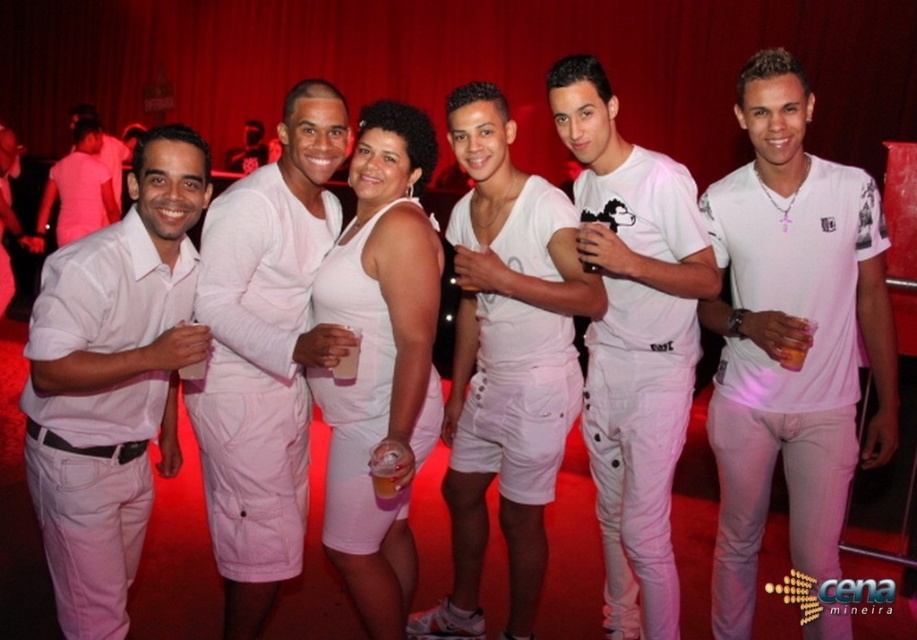
You are a photographer at the event and want to ensure that both the white fabric tank top at center and the white matte pants at center are clearly visible in the photo. Given their widths, which clothing item might require more careful framing to avoid being too wide for the camera lens? Explain your reasoning based on their sizes.

The white fabric tank top at center has a greater width than the white matte pants at center. Therefore, the white fabric tank top at center might require more careful framing to avoid being too wide for the camera lens since it is wider.

You are standing in the middle of the group at the party. There are two points in the image, point A at coordinates point (x=783, y=305) and point B at coordinates point (x=136, y=465). Which point is closer to you?

Point A at coordinates point (x=783, y=305) is closer to you because it is further to the viewer than point B at coordinates point (x=136, y=465).

You are a photographer at the event and want to focus on the white fabric tank top at center. Where should you point your camera to capture it?

You should point your camera at point (505, 362) to capture the white fabric tank top at center.